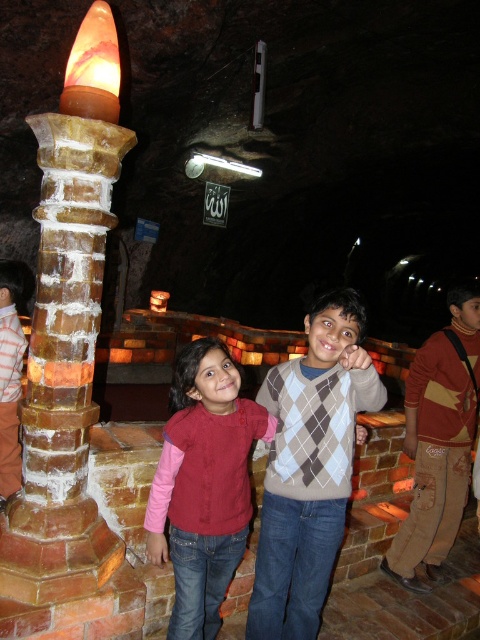
You are standing in the cave scene and want to take a closer look at the point marked at coordinates (40, 404). If your reach extends 5 feet, can you touch the point without moving your feet?

The point at coordinates (40, 404) is 8.46 feet from the camera, which is farther than your 5 feet reach. You cannot touch it without moving.

You are standing in the cave and want to take a photo of the sandy stone pillar at left and the brown cotton pants at lower right. Which object should you focus on first if you want to capture both clearly in the same frame?

You should focus on the sandy stone pillar at left first because it is closer to the viewer, ensuring both it and the brown cotton pants at lower right will be in focus when using a camera with a shallow depth of field.

You are a photographer setting up a shoot in this cave. You need to place a 2m tall backdrop behind the sandy stone pillar at left and the argyle sweater at center. Will the backdrop be tall enough to cover both objects?

The sandy stone pillar at left has a greater height compared to the argyle sweater at center. Since the backdrop is 2m tall, it will be tall enough to cover both objects as long as the pillar is shorter than 2m. However, the exact height of the pillar isn